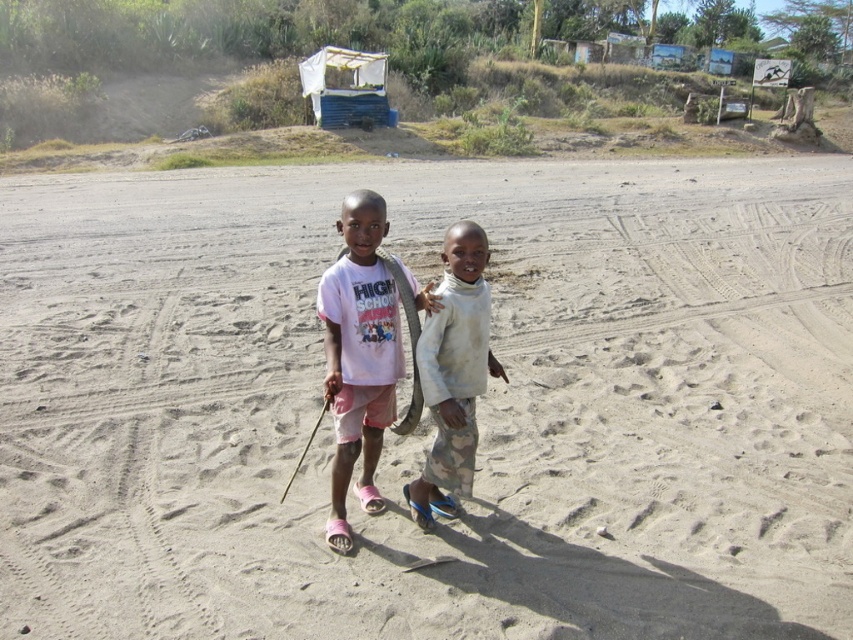
You are a photographer setting up a shot at the beach scene. You notice the white matte pants at center and the smooth wooden stick at center. Which object is covering the other one?

The white matte pants at center is positioned over smooth wooden stick at center, so the white matte pants at center is covering the smooth wooden stick at center.